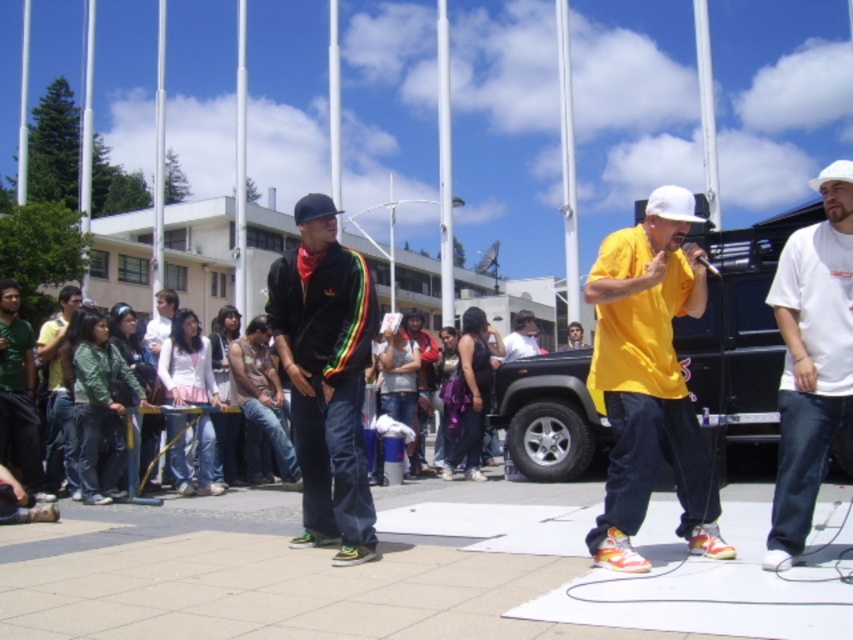
You are planning to take a photo of the black matte jeep at center and the green denim jacket at lower left. Which object should you focus on first to ensure both are in the frame?

The black matte jeep at center is in front of the green denim jacket at lower left, so you should focus on the green denim jacket at lower left first to ensure both are in the frame.

You are a photographer setting up a tripod to capture the scene. The tripod has a maximum height adjustment of 1.8 meters. The black matte jeep at center and the green denim jacket at lower left are both in your frame. Which object will require you to adjust the tripod to a higher setting to fully capture it?

The black matte jeep at center has a greater height compared to the green denim jacket at lower left, so you will need to adjust the tripod to a higher setting to fully capture the black matte jeep at center.

You are standing at the camera position and want to hand a jacket to someone. The matte black jacket at center is 17.14 feet away. Can you reach it without moving?

The matte black jacket at center is 17.14 feet away from the camera, so you cannot reach it without moving closer.